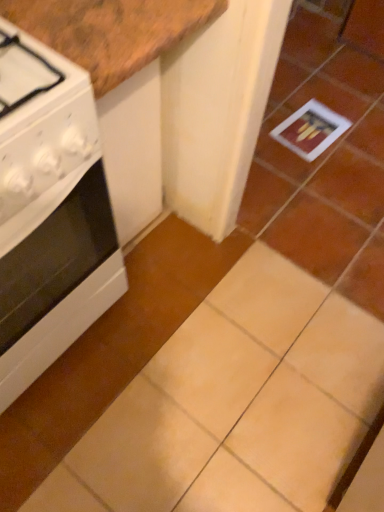
This screenshot has height=512, width=384. I want to click on white glossy oven at left, so click(49, 211).

Describe the element at coordinates (49, 211) in the screenshot. I see `white glossy oven at left` at that location.

The width and height of the screenshot is (384, 512). What are the coordinates of `white glossy oven at left` in the screenshot? It's located at (49, 211).